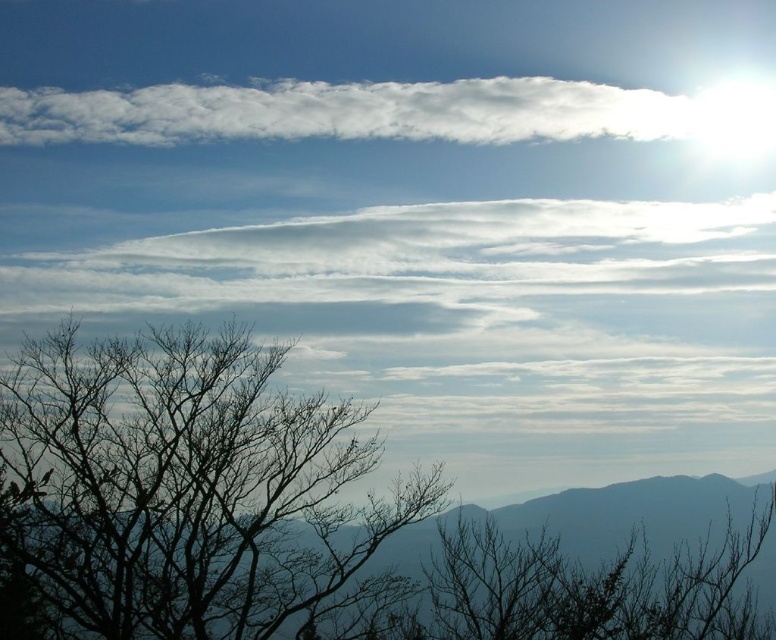
Between point (404, 509) and point (189, 138), which one is positioned behind?

Point (189, 138)

Is black bare tree at left positioned before white fluffy cloud at upper center?

Yes, black bare tree at left is closer to the viewer.

The height and width of the screenshot is (640, 776). What do you see at coordinates (189, 486) in the screenshot? I see `black bare tree at left` at bounding box center [189, 486].

The image size is (776, 640). I want to click on black bare tree at left, so click(x=189, y=486).